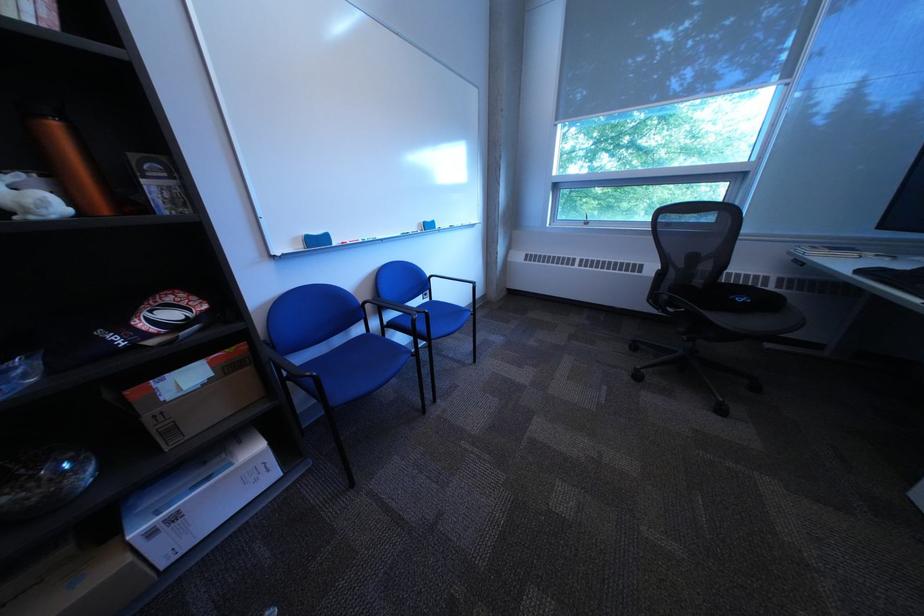
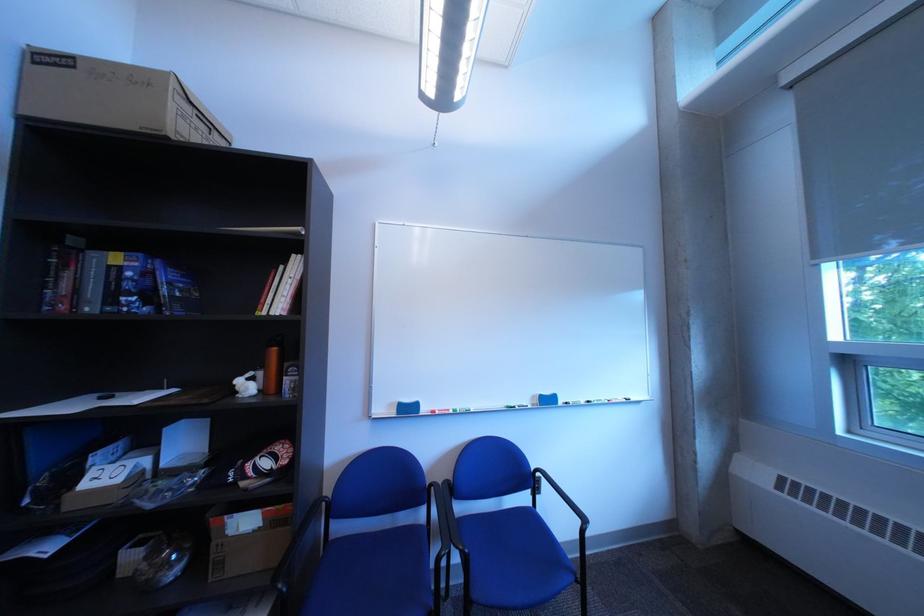
Where in the second image is the point corresponding to point 190,430 from the first image?

(237, 565)